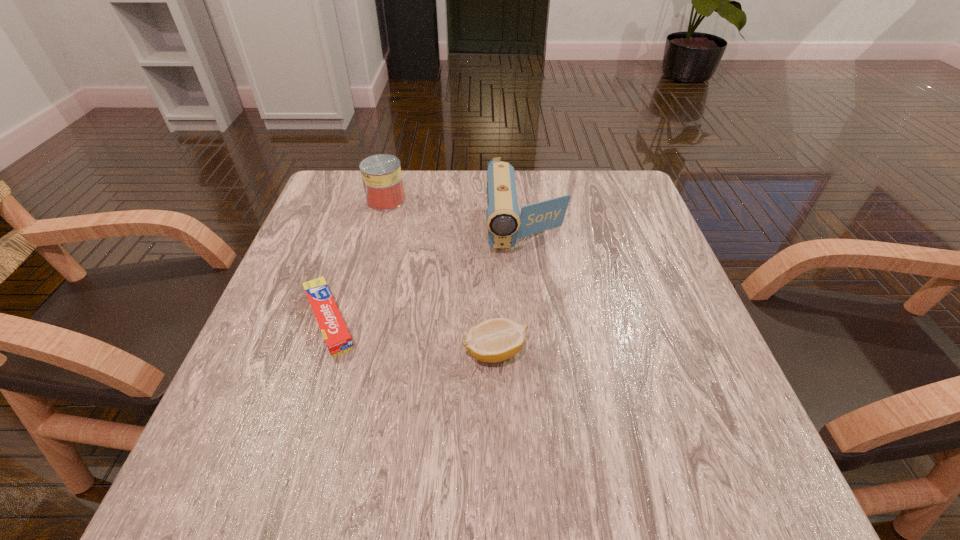
The image size is (960, 540). Identify the location of free space in the image that satisfies the following two spatial constraints: 1. on the back side of the can; 2. on the left side of the toothpaste. (368, 200).